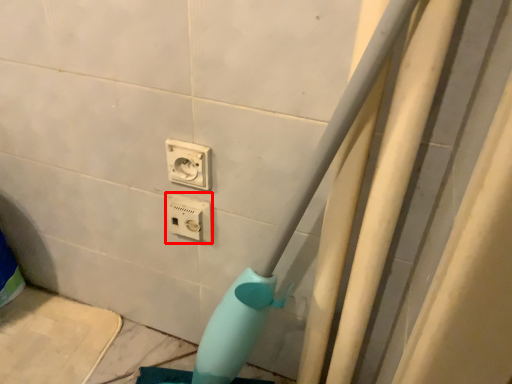
Question: From the image, what is the correct spatial relationship of power plugs and sockets (annotated by the red box) in relation to power plugs and sockets?

Choices:
 (A) left
 (B) right

Answer: (A)